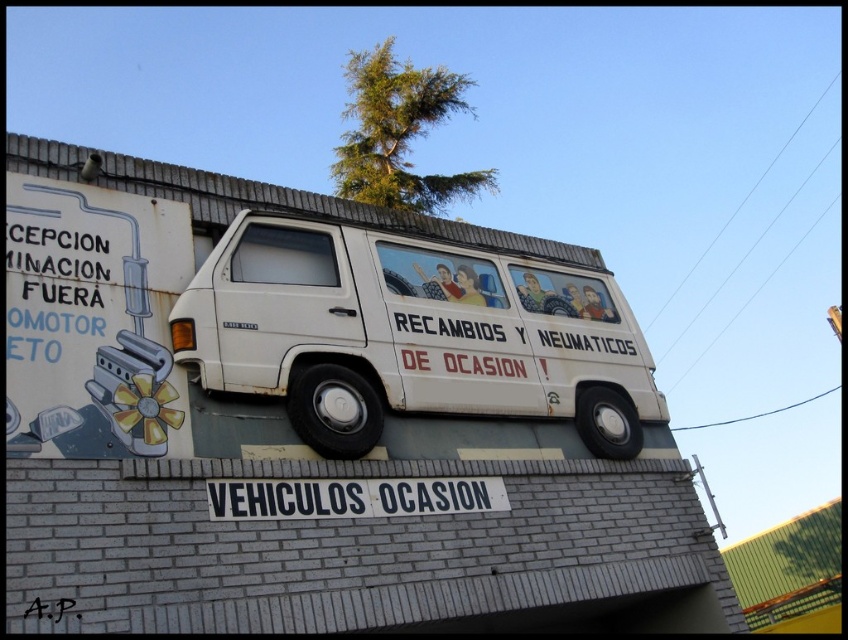
You are a delivery person trying to park your 1.8 meter wide truck between the white matte van at center and the white painted signboard at center. Can you fit your truck there?

The white matte van at center might be wider than white painted signboard at center, so there is uncertainty about the available space. If the van is indeed wider, the space between them may be insufficient for your 1.8 meter wide truck. You should measure the gap first before attempting to park.